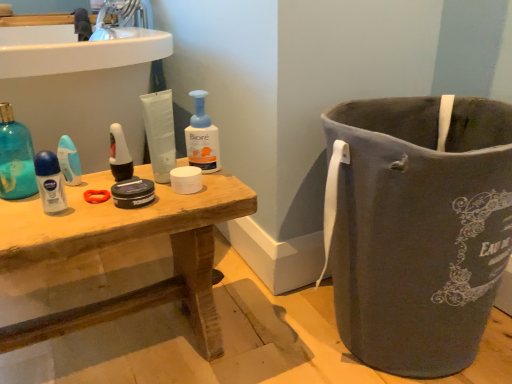
The image size is (512, 384). I want to click on vacant area that is in front of matte white shaving cream at left, so click(39, 224).